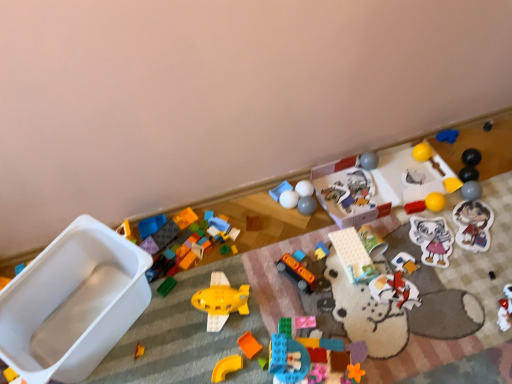
Question: Does yellow plastic curve at center, which ranks as the 21th toy in right-to-left order, have a smaller size compared to matte plastic blocks at center, the eighteenth toy in the right-to-left sequence?

Choices:
 (A) yes
 (B) no

Answer: (A)

Question: Is yellow plastic curve at center, the fifth toy in the left-to-right sequence, to the left of matte plastic blocks at center, the eighth toy positioned from the left, from the viewer's perspective?

Choices:
 (A) no
 (B) yes

Answer: (B)

Question: Is the surface of yellow plastic curve at center, which ranks as the 21th toy in right-to-left order, in direct contact with matte plastic blocks at center, the eighteenth toy in the right-to-left sequence?

Choices:
 (A) yes
 (B) no

Answer: (B)

Question: Can you confirm if yellow plastic curve at center, which ranks as the 21th toy in right-to-left order, is bigger than matte plastic blocks at center, the eighth toy positioned from the left?

Choices:
 (A) yes
 (B) no

Answer: (B)

Question: Considering the relative sizes of yellow plastic curve at center, the fifth toy in the left-to-right sequence, and matte plastic blocks at center, the eighteenth toy in the right-to-left sequence, in the image provided, is yellow plastic curve at center, the fifth toy in the left-to-right sequence, thinner than matte plastic blocks at center, the eighteenth toy in the right-to-left sequence,?

Choices:
 (A) yes
 (B) no

Answer: (A)

Question: Is white matte balls at center, the ninth toy viewed from the left, wider or thinner than yellow plastic curve at center, the fifth toy in the left-to-right sequence?

Choices:
 (A) wide
 (B) thin

Answer: (B)

Question: Considering the relative positions of white matte balls at center, the ninth toy viewed from the left, and yellow plastic curve at center, the fifth toy in the left-to-right sequence, in the image provided, is white matte balls at center, the ninth toy viewed from the left, to the left or to the right of yellow plastic curve at center, the fifth toy in the left-to-right sequence,?

Choices:
 (A) left
 (B) right

Answer: (B)

Question: From a real-world perspective, relative to yellow plastic curve at center, which ranks as the 21th toy in right-to-left order, is white matte balls at center, the ninth toy viewed from the left, vertically above or below?

Choices:
 (A) below
 (B) above

Answer: (B)

Question: Does point (285, 192) appear closer or farther from the camera than point (229, 362)?

Choices:
 (A) closer
 (B) farther

Answer: (B)

Question: From the image's perspective, is pink matte block at center, the twelfth toy viewed from the left, positioned above or below white plastic container at left, arranged as the 25th toy when viewed from the right?

Choices:
 (A) above
 (B) below

Answer: (B)

Question: In terms of width, does pink matte block at center, acting as the 14th toy starting from the right, look wider or thinner when compared to white plastic container at left, which is the 1th toy in left-to-right order?

Choices:
 (A) thin
 (B) wide

Answer: (A)

Question: Is pink matte block at center, acting as the 14th toy starting from the right, spatially inside white plastic container at left, which is the 1th toy in left-to-right order, or outside of it?

Choices:
 (A) outside
 (B) inside

Answer: (A)

Question: Considering the positions of pink matte block at center, acting as the 14th toy starting from the right, and white plastic container at left, arranged as the 25th toy when viewed from the right, in the image, is pink matte block at center, acting as the 14th toy starting from the right, taller or shorter than white plastic container at left, arranged as the 25th toy when viewed from the right,?

Choices:
 (A) tall
 (B) short

Answer: (B)

Question: Considering the positions of translucent plastic blocks at center, positioned as the 15th toy in right-to-left order, and orange matte bus at center, the sixteenth toy in the right-to-left sequence, in the image, is translucent plastic blocks at center, positioned as the 15th toy in right-to-left order, taller or shorter than orange matte bus at center, the sixteenth toy in the right-to-left sequence,?

Choices:
 (A) tall
 (B) short

Answer: (A)

Question: Is point (216, 375) positioned closer to the camera than point (296, 274)?

Choices:
 (A) farther
 (B) closer

Answer: (B)